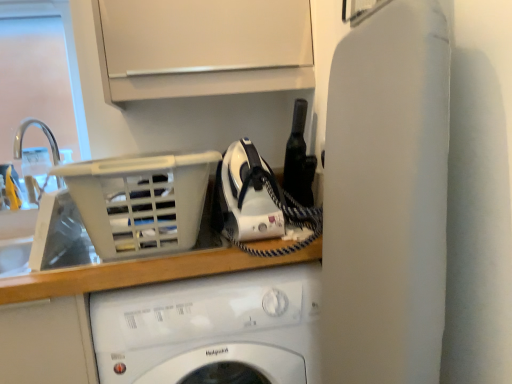
Question: From the image's perspective, is white plastic sink at left under white plastic basket at upper left?

Choices:
 (A) no
 (B) yes

Answer: (A)

Question: Is white plastic sink at left positioned far away from white plastic basket at upper left?

Choices:
 (A) yes
 (B) no

Answer: (B)

Question: Would you say white plastic sink at left is outside white plastic basket at upper left?

Choices:
 (A) no
 (B) yes

Answer: (B)

Question: Can you confirm if white plastic sink at left is smaller than white plastic basket at upper left?

Choices:
 (A) no
 (B) yes

Answer: (B)

Question: Is white plastic sink at left at the left side of white plastic basket at upper left?

Choices:
 (A) no
 (B) yes

Answer: (B)

Question: From their relative heights in the image, would you say white glossy washing machine at center is taller or shorter than white plastic sink at left?

Choices:
 (A) short
 (B) tall

Answer: (B)

Question: Considering their positions, is white glossy washing machine at center located in front of or behind white plastic sink at left?

Choices:
 (A) front
 (B) behind

Answer: (A)

Question: Is white glossy washing machine at center bigger or smaller than white plastic sink at left?

Choices:
 (A) big
 (B) small

Answer: (A)

Question: Considering the positions of white glossy washing machine at center and white plastic sink at left in the image, is white glossy washing machine at center wider or thinner than white plastic sink at left?

Choices:
 (A) thin
 (B) wide

Answer: (B)

Question: Is white plastic basket at upper left inside the boundaries of white glossy washing machine at center, or outside?

Choices:
 (A) outside
 (B) inside

Answer: (A)

Question: In terms of height, does white plastic basket at upper left look taller or shorter compared to white glossy washing machine at center?

Choices:
 (A) tall
 (B) short

Answer: (B)

Question: Looking at their shapes, would you say white plastic basket at upper left is wider or thinner than white glossy washing machine at center?

Choices:
 (A) wide
 (B) thin

Answer: (A)

Question: Is white plastic basket at upper left bigger or smaller than white glossy washing machine at center?

Choices:
 (A) small
 (B) big

Answer: (A)

Question: Based on their positions, is white glossy washing machine at center located to the left or right of white plastic basket at upper left?

Choices:
 (A) left
 (B) right

Answer: (B)

Question: From a real-world perspective, is white glossy washing machine at center physically located above or below white plastic basket at upper left?

Choices:
 (A) above
 (B) below

Answer: (B)